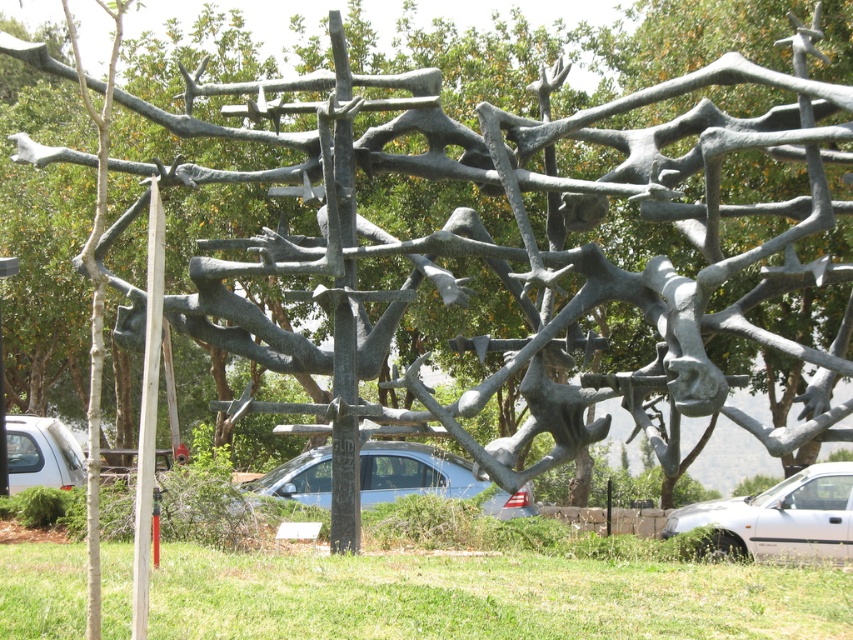
Question: Can you confirm if bronze textured pole at center is positioned to the left of wooden pole at left?

Choices:
 (A) no
 (B) yes

Answer: (A)

Question: Which of the following is the farthest from the observer?

Choices:
 (A) white matte car at lower left
 (B) wooden pole at left

Answer: (A)

Question: Which is nearer to the wooden pole at left?

Choices:
 (A) white matte car at lower left
 (B) silver metallic car at lower right
 (C) satin silver car at center
 (D) bronze textured pole at center

Answer: (D)

Question: Among these objects, which one is farthest from the camera?

Choices:
 (A) wooden pole at left
 (B) silver metallic car at lower right
 (C) satin silver car at center

Answer: (B)

Question: Considering the relative positions of satin silver car at center and wooden pole at left in the image provided, where is satin silver car at center located with respect to wooden pole at left?

Choices:
 (A) above
 (B) below

Answer: (B)

Question: Does bronze textured pole at center appear over wooden pole at left?

Choices:
 (A) yes
 (B) no

Answer: (A)